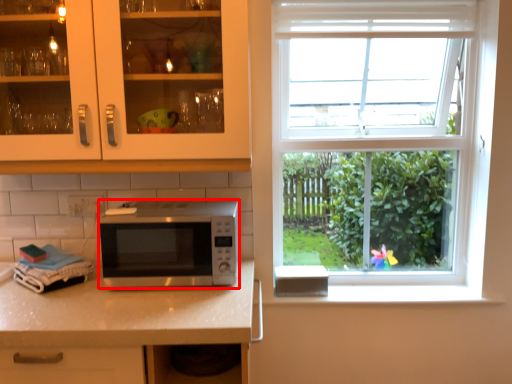
Question: From the image's perspective, what is the correct spatial relationship of microwave oven (annotated by the red box) in relation to cabinetry?

Choices:
 (A) above
 (B) below

Answer: (B)